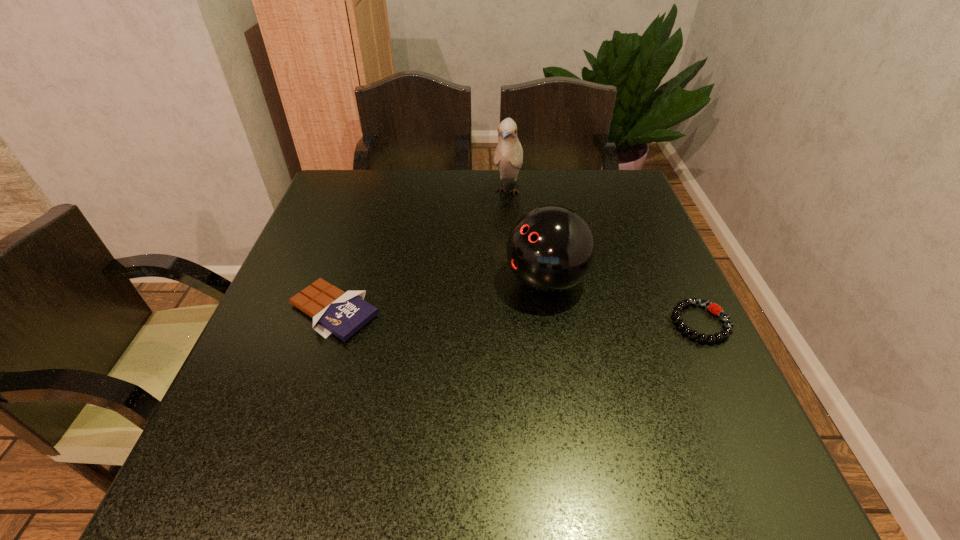
The image size is (960, 540). I want to click on vacant space on the desktop that is between the second shortest object and the rightmost object and is positioned on the surface of the third shortest object near the finger holes, so click(469, 315).

Identify the location of free space on the desktop that is between the chocolate bar and the rightmost object and is positioned at the beak of the farthest object. This screenshot has width=960, height=540. (466, 315).